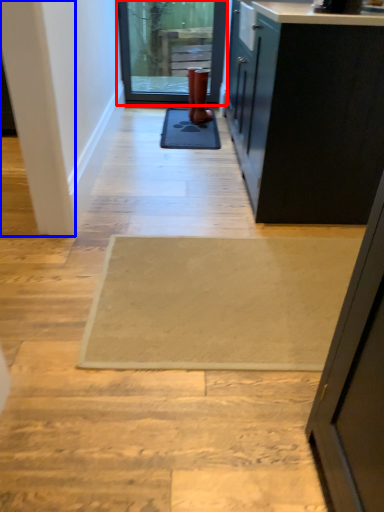
Question: Among these objects, which one is farthest to the camera, door (highlighted by a red box) or pillar (highlighted by a blue box)?

Choices:
 (A) door
 (B) pillar

Answer: (A)